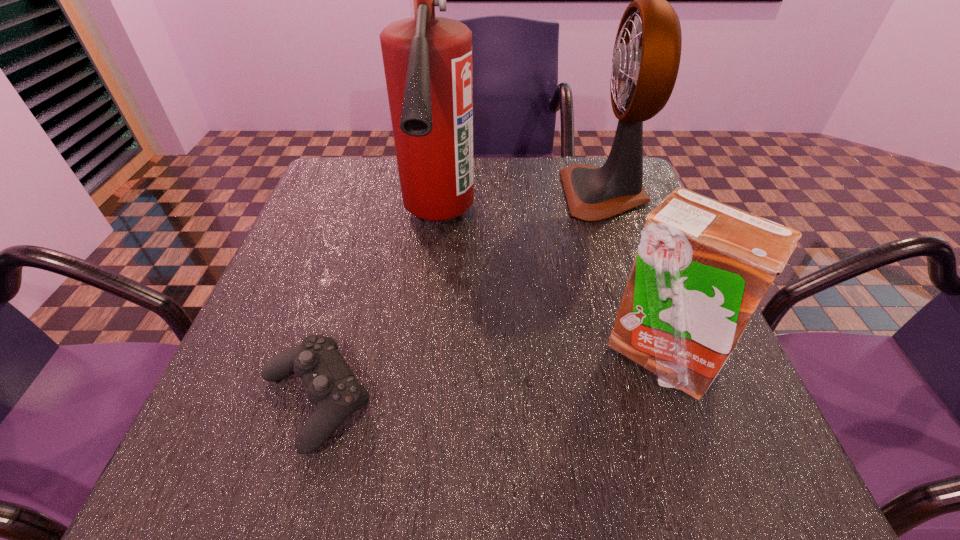
At what (x,y) coordinates should I click in order to perform the action: click on fire extinguisher that is at the far edge. Please return your answer as a coordinate pair (x, y). The width and height of the screenshot is (960, 540). Looking at the image, I should click on (427, 60).

I want to click on fan that is positioned at the far edge, so click(646, 57).

This screenshot has width=960, height=540. In order to click on object that is at the near edge in this screenshot , I will do `click(332, 387)`.

The height and width of the screenshot is (540, 960). I want to click on object situated at the left edge, so click(332, 387).

I want to click on fan positioned at the right edge, so (x=646, y=57).

The width and height of the screenshot is (960, 540). I want to click on carton positioned at the right edge, so [x=702, y=268].

The height and width of the screenshot is (540, 960). Find the location of `object that is at the near left corner`. object that is at the near left corner is located at coordinates (332, 387).

Where is `object at the far right corner`? The height and width of the screenshot is (540, 960). object at the far right corner is located at coordinates (646, 57).

Locate an element on the screen. blank area at the far edge is located at coordinates (525, 161).

Find the location of a particular element. vacant space at the near edge of the desktop is located at coordinates (343, 453).